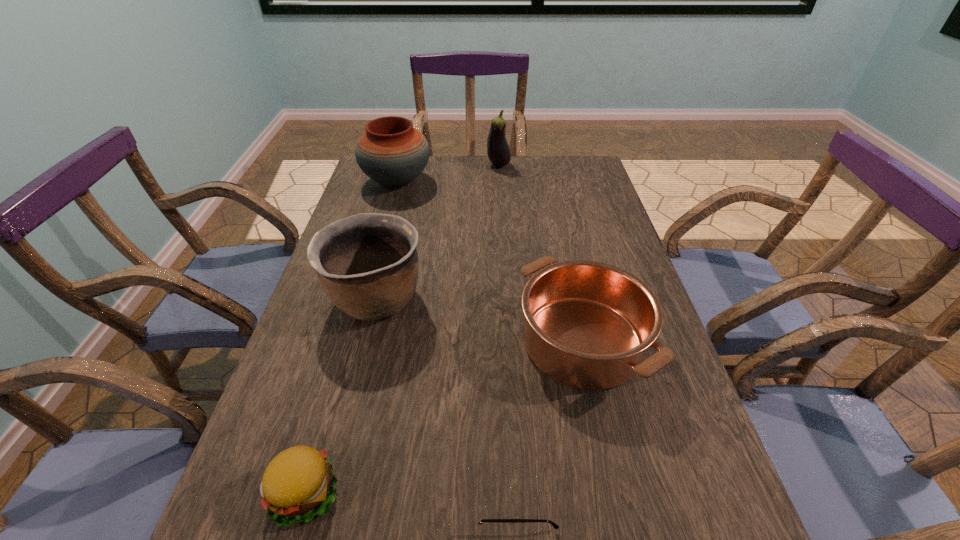
The image size is (960, 540). Identify the location of eggplant. (498, 150).

Image resolution: width=960 pixels, height=540 pixels. In order to click on the farther pottery in this screenshot , I will do `click(392, 152)`.

Locate an element on the screen. Image resolution: width=960 pixels, height=540 pixels. the nearer pottery is located at coordinates (367, 264).

Identify the location of the fourth tallest object. The height and width of the screenshot is (540, 960). (588, 324).

What are the coordinates of `hamburger` in the screenshot? It's located at (299, 482).

At what (x,y) coordinates should I click in order to perform the action: click on vacant area located 0.060m on the right of the eggplant. Please return your answer as a coordinate pair (x, y). This screenshot has width=960, height=540. Looking at the image, I should click on (527, 165).

This screenshot has width=960, height=540. In order to click on vacant region located on the front of the farther pottery in this screenshot , I will do `click(389, 211)`.

I want to click on vacant region located on the right of the nearer pottery, so click(x=462, y=299).

The image size is (960, 540). I want to click on free region located 0.170m on the front of the saucepan, so click(x=617, y=503).

Where is `blank area located on the back of the fifth tallest object`? The image size is (960, 540). blank area located on the back of the fifth tallest object is located at coordinates (348, 343).